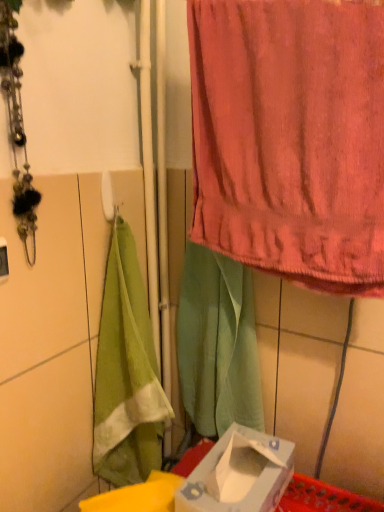
Question: Is green fabric at center oriented away from white cardboard box at lower center?

Choices:
 (A) no
 (B) yes

Answer: (A)

Question: From a real-world perspective, is green fabric at center physically above white cardboard box at lower center?

Choices:
 (A) no
 (B) yes

Answer: (B)

Question: Would you say white cardboard box at lower center is part of green fabric at center's contents?

Choices:
 (A) yes
 (B) no

Answer: (B)

Question: From the image's perspective, is green fabric at center on white cardboard box at lower center?

Choices:
 (A) yes
 (B) no

Answer: (A)

Question: Can you confirm if green fabric at center is smaller than white cardboard box at lower center?

Choices:
 (A) no
 (B) yes

Answer: (A)

Question: Is green fabric at center shorter than white cardboard box at lower center?

Choices:
 (A) no
 (B) yes

Answer: (A)

Question: From the image's perspective, is white cardboard box at lower center below pink terry cloth towel at upper right?

Choices:
 (A) no
 (B) yes

Answer: (B)

Question: Is white cardboard box at lower center closer to camera compared to pink terry cloth towel at upper right?

Choices:
 (A) yes
 (B) no

Answer: (B)

Question: Is white cardboard box at lower center far from pink terry cloth towel at upper right?

Choices:
 (A) yes
 (B) no

Answer: (B)

Question: From the image's perspective, is white cardboard box at lower center located above pink terry cloth towel at upper right?

Choices:
 (A) no
 (B) yes

Answer: (A)

Question: Does white cardboard box at lower center come behind pink terry cloth towel at upper right?

Choices:
 (A) yes
 (B) no

Answer: (A)

Question: Does white cardboard box at lower center have a lesser height compared to pink terry cloth towel at upper right?

Choices:
 (A) yes
 (B) no

Answer: (A)

Question: Is white cardboard box at lower center oriented away from green fabric at center?

Choices:
 (A) no
 (B) yes

Answer: (A)